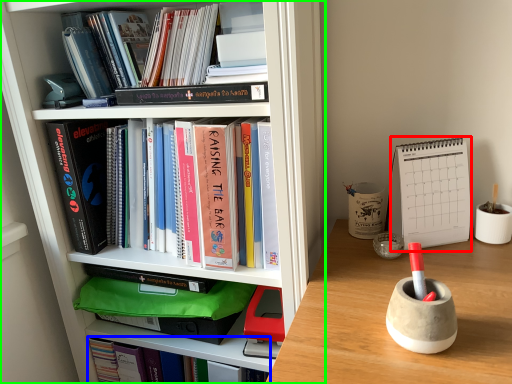
Question: Estimate the real-world distances between objects in this image. Which object is closer to paperback book (highlighted by a red box), book (highlighted by a blue box) or bookcase (highlighted by a green box)?

Choices:
 (A) book
 (B) bookcase

Answer: (B)